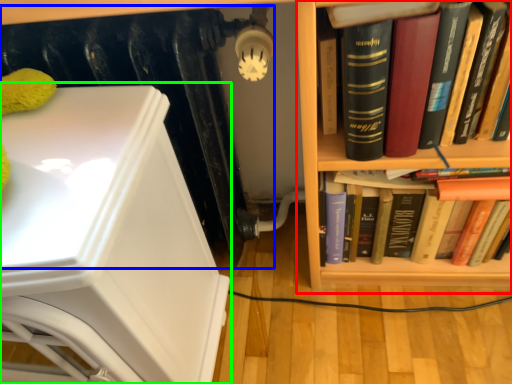
Question: Based on their relative distances, which object is nearer to bookcase (highlighted by a red box)? Choose from radiator (highlighted by a blue box) and armchair (highlighted by a green box).

Choices:
 (A) radiator
 (B) armchair

Answer: (A)